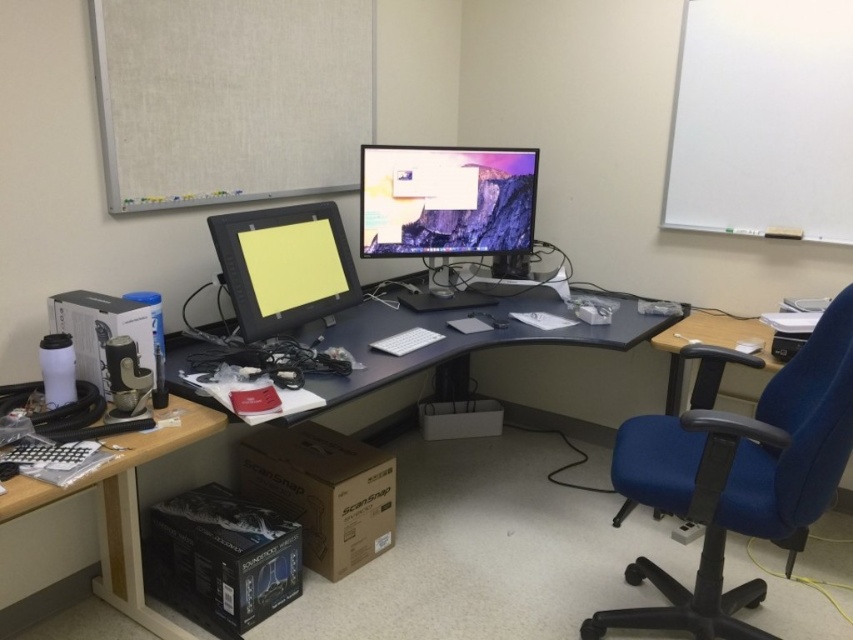
You are sitting in the blue fabric swivel chair at right and want to reach the white keyboard and mouse. Based on their positions, can you easily reach them without moving your chair?

The blue fabric swivel chair at right is located at point (738,480). Since the white keyboard and mouse are placed near the larger monitor, which is likely positioned closer to the edge of the desk where the chair is situated, it is probable that you can easily reach them without moving your chair.

You are organizing your workspace and need to place a new 12 inch wide laptop between the matte black computer desk at center and the black plastic keyboard at lower left. Is there enough space to fit the laptop without moving either object?

The distance between the matte black computer desk at center and the black plastic keyboard at lower left is 36.91 inches. Since the laptop is only 12 inches wide, there is sufficient space to place it between them without needing to move either object.